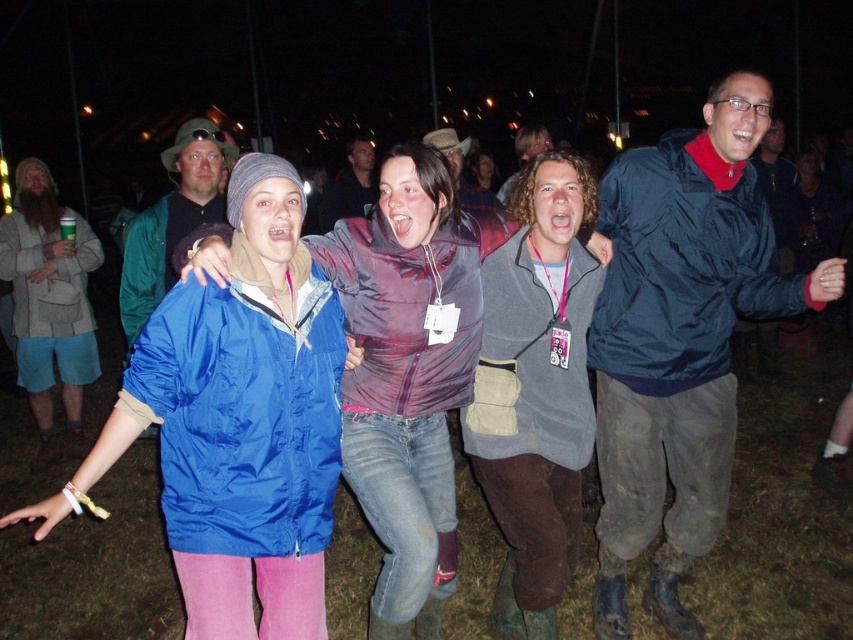
You are organizing a costume party and need to decide which outfit to wear. You have a matte green jacket at center and a matte purple shirt at center. If you want to choose the wider option, which one should you pick?

The matte purple shirt at center is wider than the matte green jacket at center, so you should pick the matte purple shirt at center.

Based on the photo, you are at a night festival and see two people in front of you wearing a matte green jacket at center and a matte purple shirt at center. Which one is more to the left?

The matte green jacket at center is more to the left than the matte purple shirt at center.